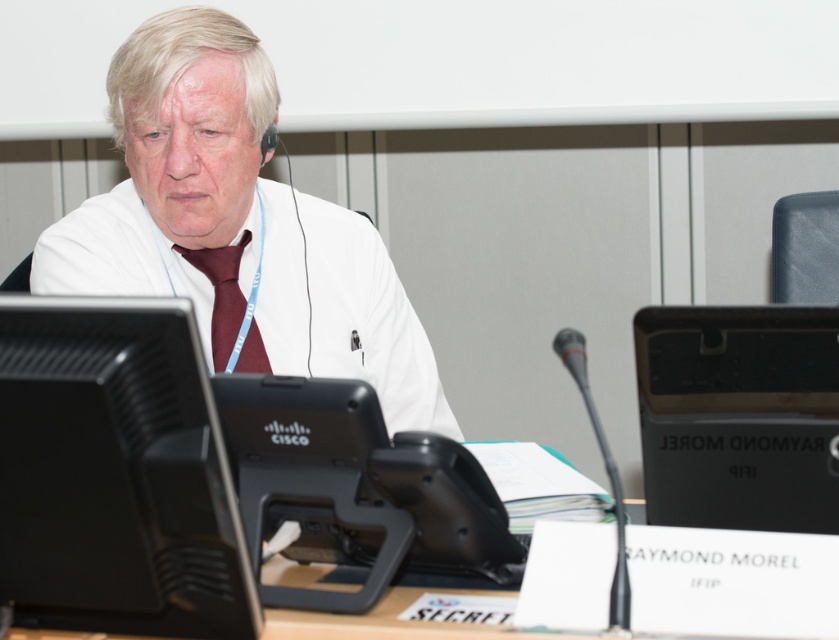
You are an interior designer planning to add a decorative item between the black plastic desktop computer at right and the burgundy satin tie at center. Based on their positions, where should the item be placed?

The black plastic desktop computer at right is below the burgundy satin tie at center, so placing the decorative item between them would require positioning it above the computer and below the tie.

You are a healthcare worker entering a lab and see the white matte lab coat at center and the burgundy satin tie at center. Which item is located higher on the person?

The white matte lab coat at center is located higher than the burgundy satin tie at center.